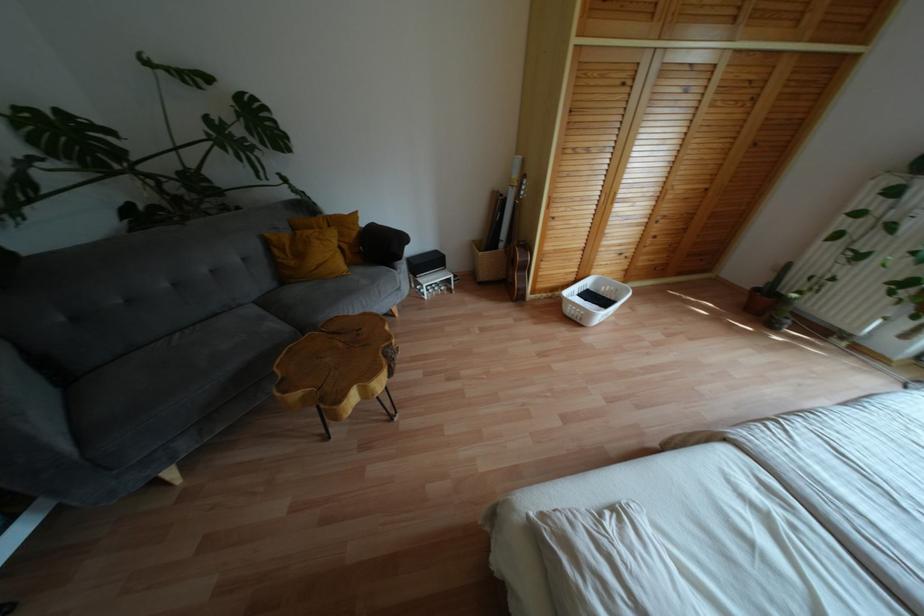
What do you see at coordinates (31, 403) in the screenshot? This screenshot has width=924, height=616. I see `the sofa armrest` at bounding box center [31, 403].